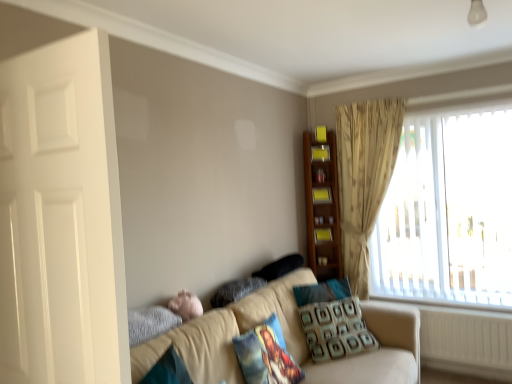
Question: Is wooden shelf at upper right, the 3th shelf in the bottom-to-top sequence, surrounded by velvety gray pillow at lower center, the third pillow from the back?

Choices:
 (A) no
 (B) yes

Answer: (A)

Question: Considering the relative sizes of velvety gray pillow at lower center, which is counted as the 2th pillow, starting from the front, and wooden shelf at upper right, which is the first shelf in top-to-bottom order, in the image provided, is velvety gray pillow at lower center, which is counted as the 2th pillow, starting from the front, thinner than wooden shelf at upper right, which is the first shelf in top-to-bottom order,?

Choices:
 (A) no
 (B) yes

Answer: (A)

Question: Is velvety gray pillow at lower center, the third pillow from the back, to the left of wooden shelf at upper right, the 3th shelf in the bottom-to-top sequence, from the viewer's perspective?

Choices:
 (A) yes
 (B) no

Answer: (A)

Question: Is velvety gray pillow at lower center, the third pillow from the back, behind wooden shelf at upper right, the 3th shelf in the bottom-to-top sequence?

Choices:
 (A) no
 (B) yes

Answer: (A)

Question: From a real-world perspective, is velvety gray pillow at lower center, the third pillow from the back, located higher than wooden shelf at upper right, the 3th shelf in the bottom-to-top sequence?

Choices:
 (A) yes
 (B) no

Answer: (B)

Question: Is velvety gray pillow at lower center, which is counted as the 2th pillow, starting from the front, taller than wooden shelf at upper right, which is the first shelf in top-to-bottom order?

Choices:
 (A) yes
 (B) no

Answer: (B)

Question: Is velvety gray pillow at lower center, the third pillow from the back, oriented away from patterned fabric pillow at lower right, which is counted as the third pillow, starting from the front?

Choices:
 (A) no
 (B) yes

Answer: (A)

Question: Is velvety gray pillow at lower center, the third pillow from the back, bigger than patterned fabric pillow at lower right, the second pillow when ordered from back to front?

Choices:
 (A) no
 (B) yes

Answer: (A)

Question: Can you confirm if velvety gray pillow at lower center, the third pillow from the back, is wider than patterned fabric pillow at lower right, which is counted as the third pillow, starting from the front?

Choices:
 (A) yes
 (B) no

Answer: (B)

Question: Considering the relative positions of velvety gray pillow at lower center, the third pillow from the back, and patterned fabric pillow at lower right, which is counted as the third pillow, starting from the front, in the image provided, is velvety gray pillow at lower center, the third pillow from the back, behind patterned fabric pillow at lower right, which is counted as the third pillow, starting from the front,?

Choices:
 (A) yes
 (B) no

Answer: (B)

Question: Is there a large distance between velvety gray pillow at lower center, the third pillow from the back, and patterned fabric pillow at lower right, which is counted as the third pillow, starting from the front?

Choices:
 (A) no
 (B) yes

Answer: (A)

Question: Can patterned fabric pillow at lower right, the second pillow when ordered from back to front, be found inside velvety gray pillow at lower center, which is counted as the 2th pillow, starting from the front?

Choices:
 (A) no
 (B) yes

Answer: (A)

Question: Can you confirm if beige fabric couch at lower center is thinner than pink plush at lower left?

Choices:
 (A) no
 (B) yes

Answer: (A)